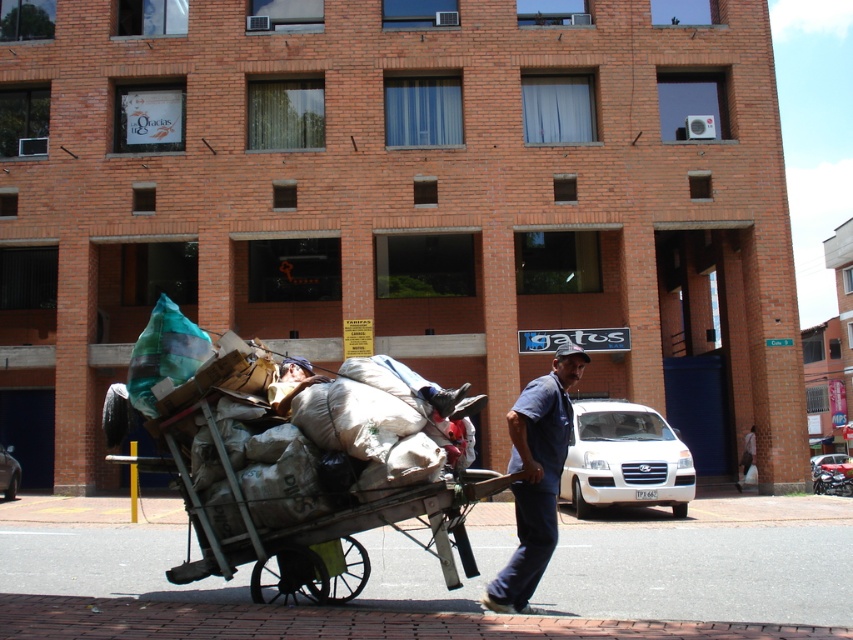
You are standing on the sidewalk and want to cross the street to reach a bus stop that is 10 meters away. The wooden cart at center is in your path. Can you safely walk around it without getting too close?

The wooden cart at center is 5.86 meters away from you. Since the bus stop is 10 meters away, you can safely walk around the cart as long as you maintain a safe distance of at least 5.86 meters from it while navigating around.

You are a delivery person who needs to deliver a package to the wooden cart at center. The delivery area requires that the package be placed precisely at the point with coordinates [315,477]. Can you confirm if the wooden cart at center is located at that point?

Yes, the point [315,477] corresponds to the wooden cart at center, so the package can be delivered there.

Based on the scene description, which object is taller when comparing the wooden cart at center and the blue denim shirt at center?

The wooden cart at center is taller than the blue denim shirt at center.